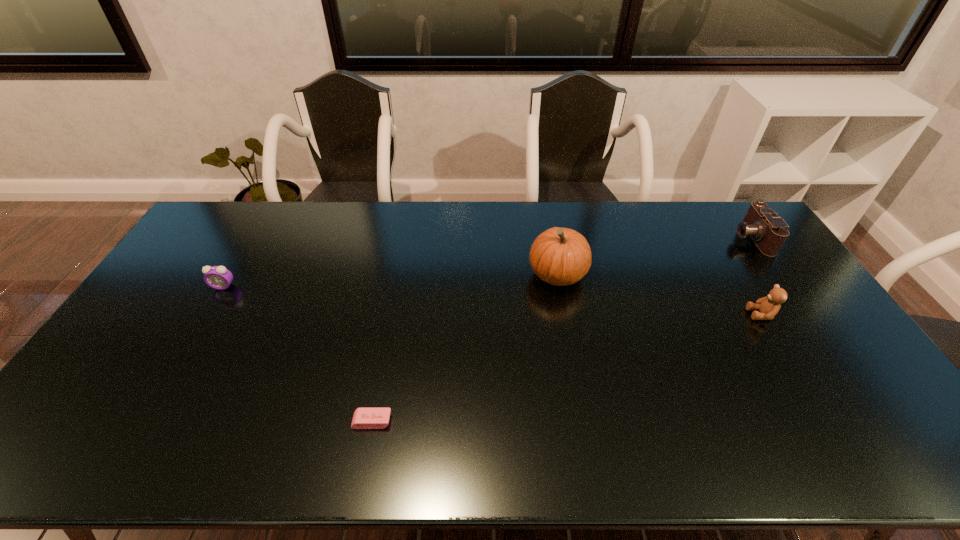
Where is `the tallest object`? the tallest object is located at coordinates (559, 256).

The image size is (960, 540). In order to click on pumpkin in this screenshot , I will do `click(559, 256)`.

The image size is (960, 540). I want to click on camera, so click(769, 232).

At what (x,y) coordinates should I click in order to perform the action: click on the fourth object from left to right. Please return your answer as a coordinate pair (x, y). Looking at the image, I should click on (768, 307).

Locate an element on the screen. teddy bear is located at coordinates pyautogui.click(x=768, y=307).

Identify the location of the leftmost object. This screenshot has width=960, height=540. (217, 277).

Where is `the fourth tallest object`? the fourth tallest object is located at coordinates (217, 277).

Where is `the second object from left to right`? the second object from left to right is located at coordinates (364, 418).

Locate an element on the screen. Image resolution: width=960 pixels, height=540 pixels. the nearest object is located at coordinates (364, 418).

At what (x,y) coordinates should I click in order to perform the action: click on vacant area located 0.070m on the stem of the pumpkin. Please return your answer as a coordinate pair (x, y). Looking at the image, I should click on (506, 275).